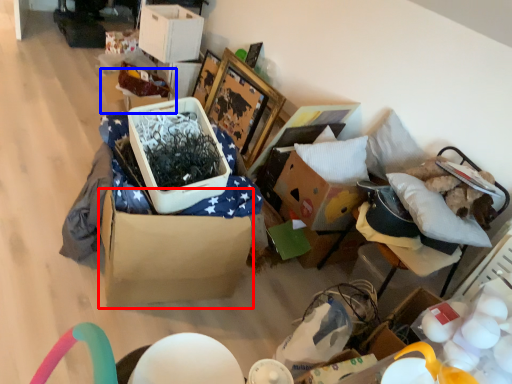
Question: Which point is closer to the camera, cardboard box (highlighted by a red box) or storage box (highlighted by a blue box)?

Choices:
 (A) cardboard box
 (B) storage box

Answer: (A)